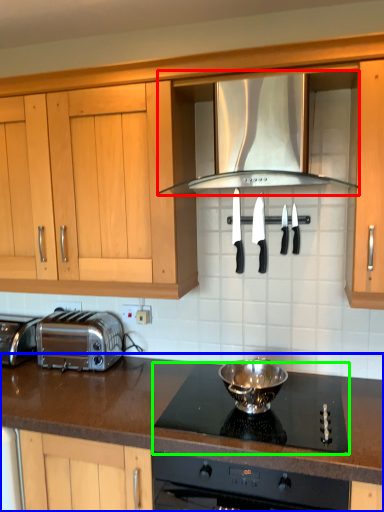
Question: Which is farther away from exhaust hood (highlighted by a red box)? countertop (highlighted by a blue box) or gas stove (highlighted by a green box)?

Choices:
 (A) countertop
 (B) gas stove

Answer: (A)